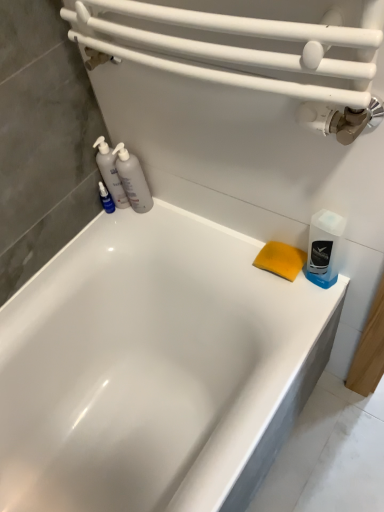
The width and height of the screenshot is (384, 512). Find the location of `vacant area that lies to the right of blue translucent bottle at left`. vacant area that lies to the right of blue translucent bottle at left is located at coordinates (162, 216).